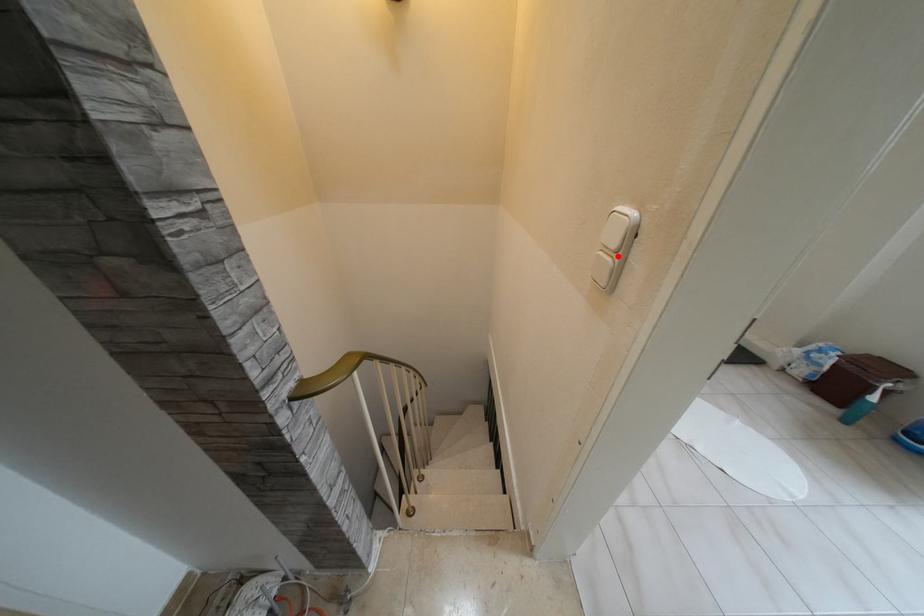
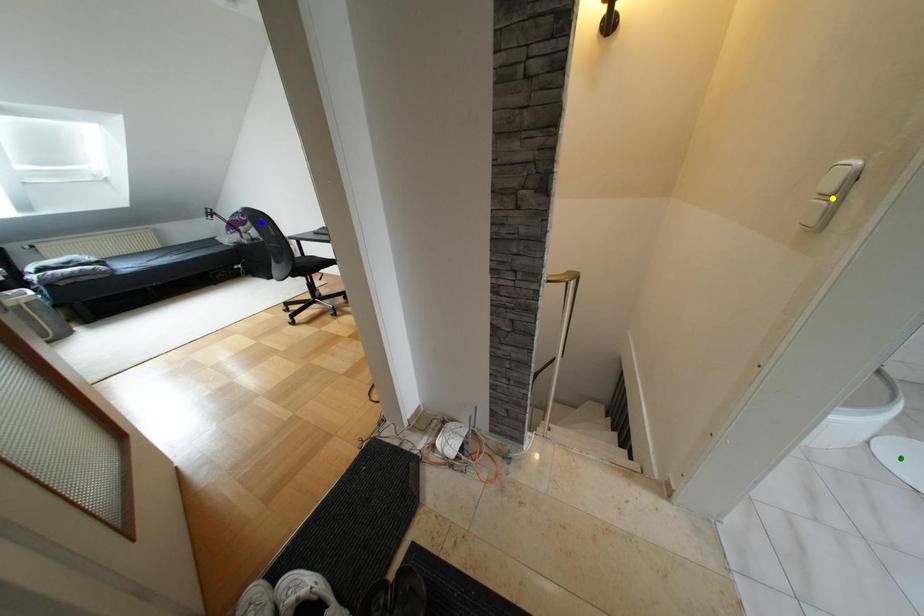
Question: I am providing you with two images of the same scene from different viewpoints. A red point is marked on the first image. You are given multiple points on the second image. Which point in image 2 is actually the same real-world point as the red point in image 1?

Choices:
 (A) blue point
 (B) green point
 (C) yellow point

Answer: (C)